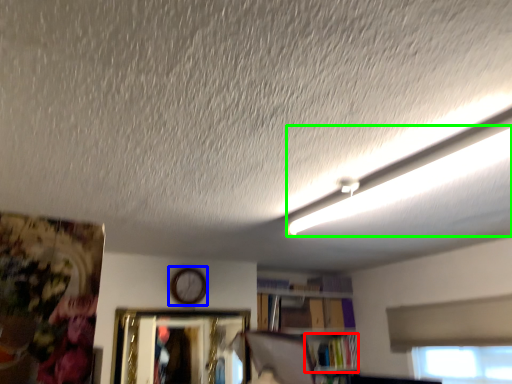
Question: Considering the real-world distances, which object is farthest from book (highlighted by a red box)? clock (highlighted by a blue box) or lighting (highlighted by a green box)?

Choices:
 (A) clock
 (B) lighting

Answer: (B)